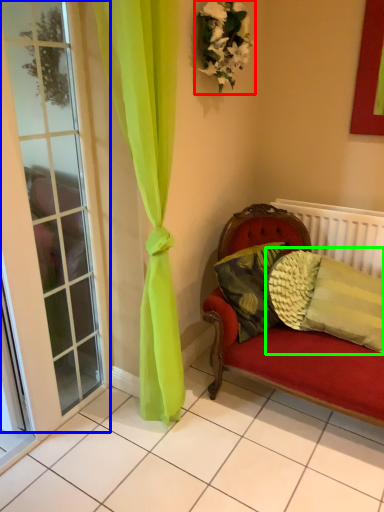
Question: Estimate the real-world distances between objects in this image. Which object is farther from floral arrangement (highlighted by a red box), window (highlighted by a blue box) or pillow (highlighted by a green box)?

Choices:
 (A) window
 (B) pillow

Answer: (B)